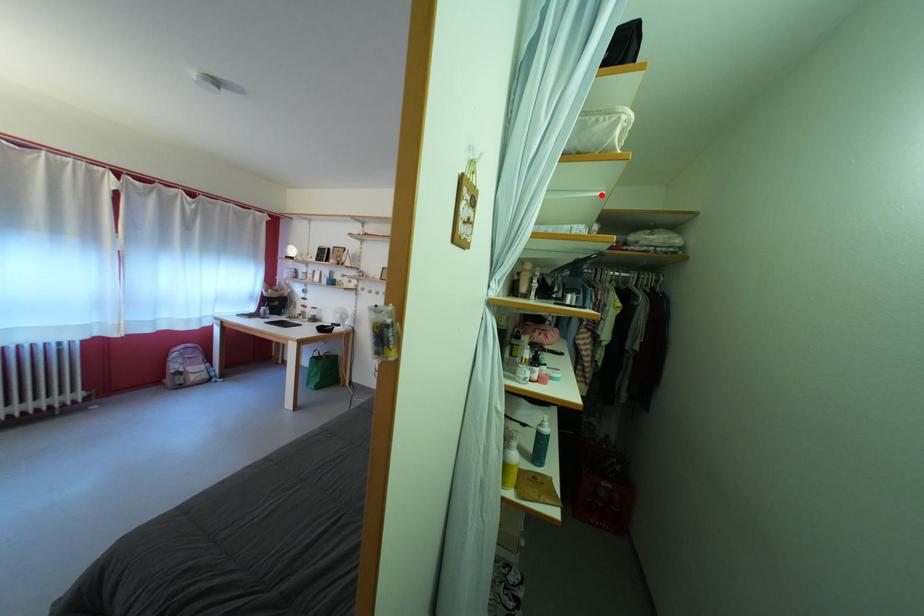
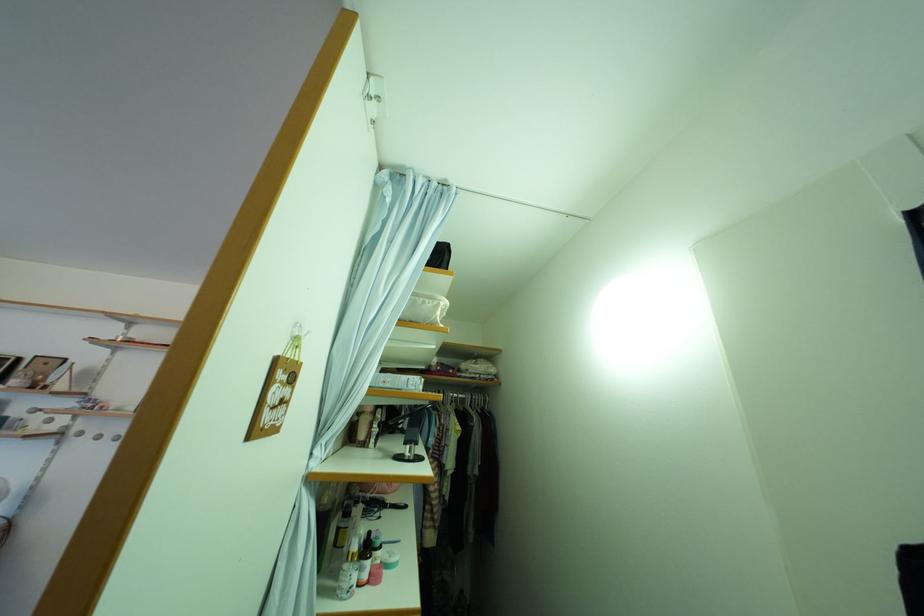
Question: I am providing you with two images of the same scene from different viewpoints. A red point is shown in image1. For the corresponding object point in image2, is it positioned nearer or farther from the camera?

Choices:
 (A) Nearer
 (B) Farther

Answer: (B)